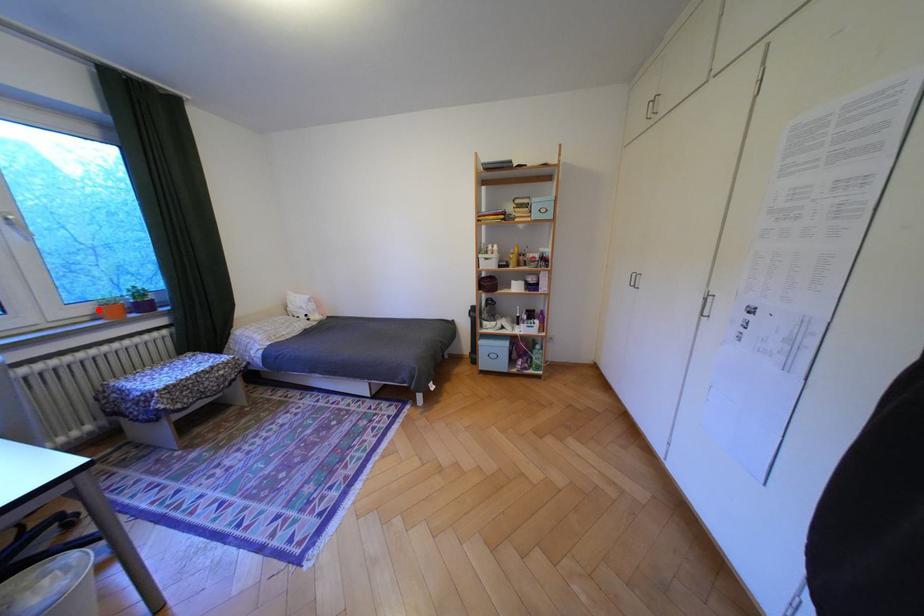
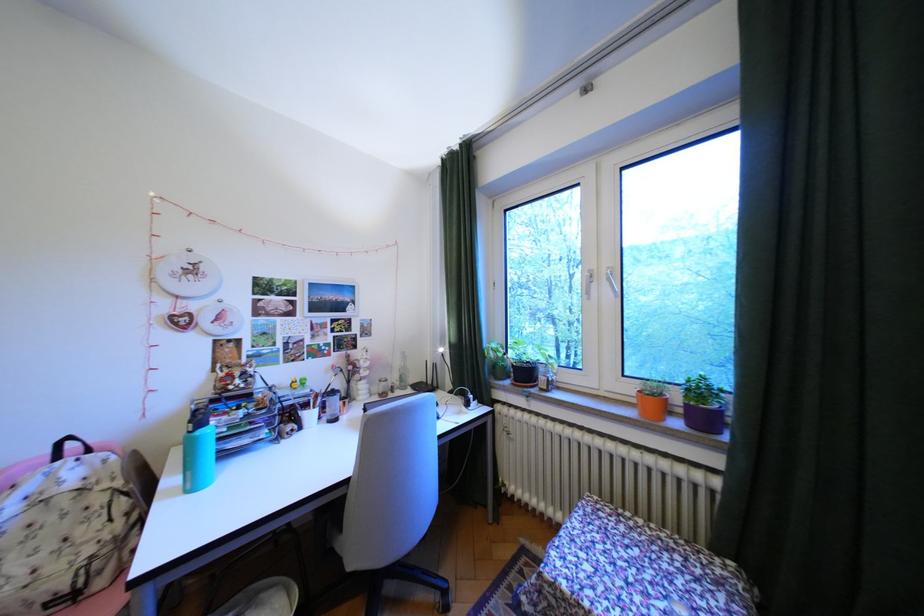
Locate, in the second image, the point that corresponds to the highlighted location in the first image.

(641, 390)